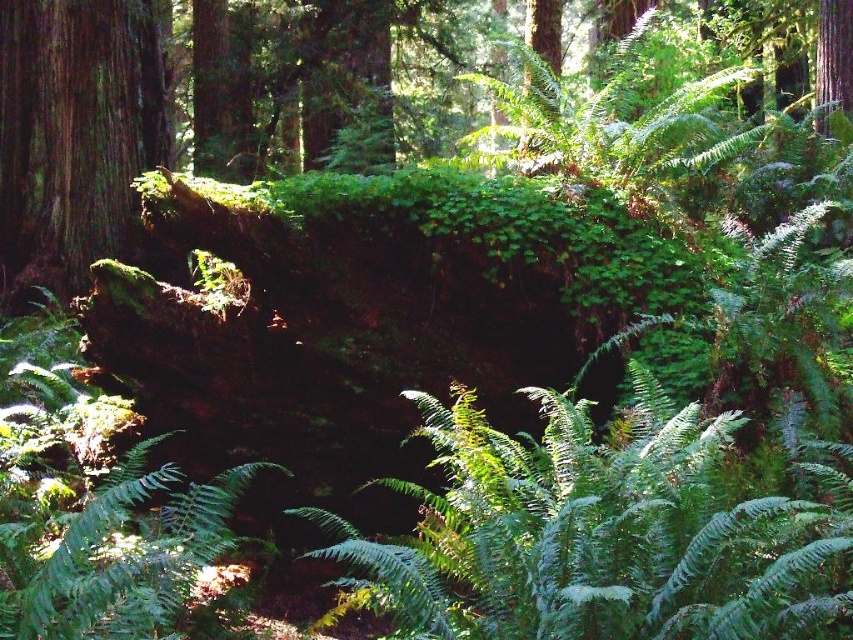
Question: Which point is farther to the camera?

Choices:
 (A) green leafy fern at center
 (B) green leafy fern at upper center
 (C) green mossy log at left

Answer: (C)

Question: Among these objects, which one is farthest from the camera?

Choices:
 (A) green mossy log at left
 (B) green leafy fern at center

Answer: (A)

Question: Does green mossy log at left appear under green leafy fern at upper center?

Choices:
 (A) no
 (B) yes

Answer: (A)

Question: Which object is farther from the camera taking this photo?

Choices:
 (A) green leafy fern at center
 (B) green leafy fern at upper center
 (C) green mossy log at left

Answer: (C)

Question: Does green mossy log at left have a lesser width compared to green leafy fern at upper center?

Choices:
 (A) no
 (B) yes

Answer: (A)

Question: Does green leafy fern at center appear on the left side of green mossy log at left?

Choices:
 (A) no
 (B) yes

Answer: (A)